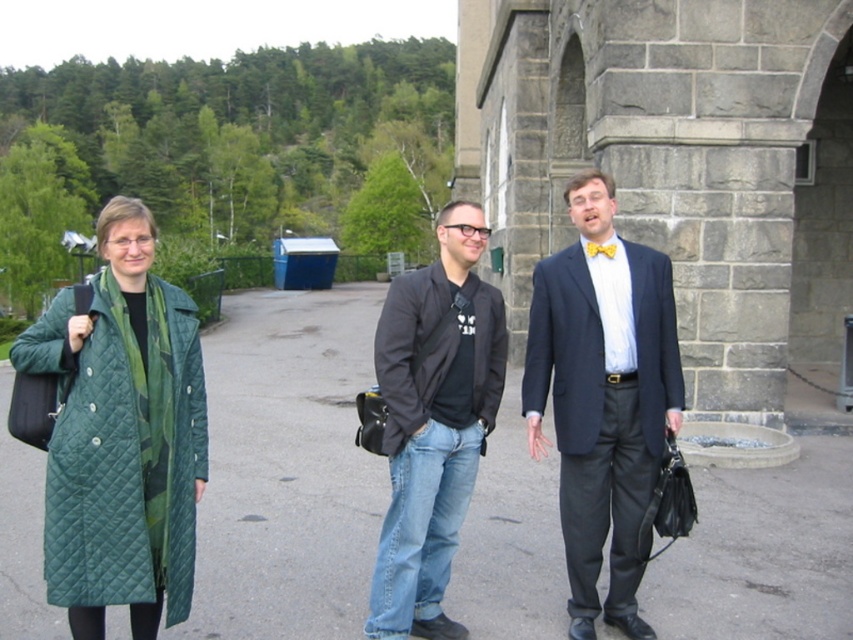
Is matte black suit at center taller than black cotton jacket at center?

Yes, matte black suit at center is taller than black cotton jacket at center.

Is matte black suit at center to the left of black cotton jacket at center from the viewer's perspective?

No, matte black suit at center is not to the left of black cotton jacket at center.

Measure the distance between matte black suit at center and camera.

4.24 meters

Locate an element on the screen. This screenshot has width=853, height=640. matte black suit at center is located at coordinates (602, 397).

Based on the photo, does matte black jacket at center lie in front of matte black suit at center?

No, matte black jacket at center is further to the viewer.

Which is above, matte black jacket at center or matte black suit at center?

matte black suit at center

Between point (625, 484) and point (598, 611), which one is positioned in front?

Positioned in front is point (625, 484).

What are the coordinates of `matte black jacket at center` in the screenshot? It's located at (x=602, y=397).

Does black quilted jacket at center have a greater height compared to yellow satin bow tie at center?

Correct, black quilted jacket at center is much taller as yellow satin bow tie at center.

Who is higher up, black quilted jacket at center or yellow satin bow tie at center?

Positioned higher is yellow satin bow tie at center.

Describe the element at coordinates (436, 349) in the screenshot. The width and height of the screenshot is (853, 640). I see `black quilted jacket at center` at that location.

Find the location of a particular element. The width and height of the screenshot is (853, 640). black quilted jacket at center is located at coordinates (436, 349).